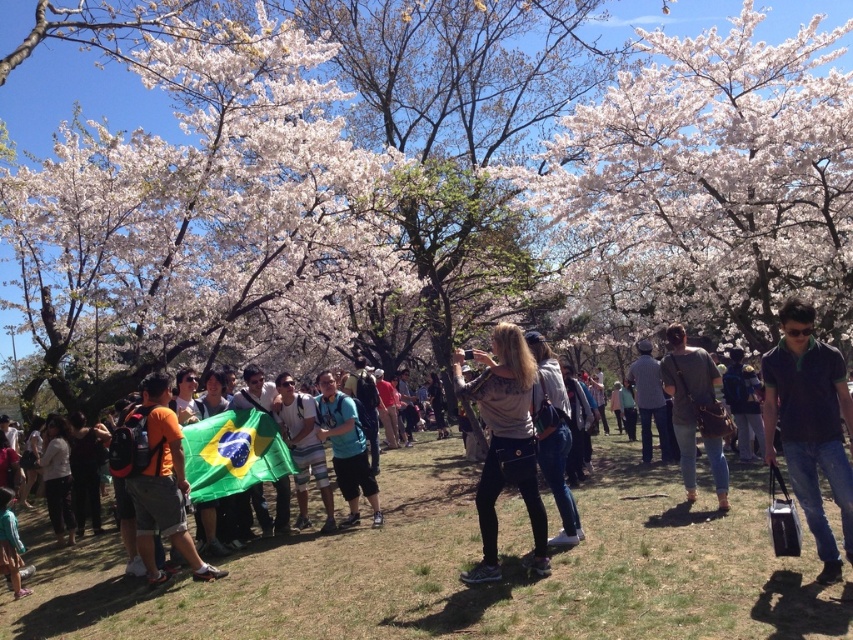
Question: Considering the real-world distances, which object is farthest from the blue fabric at center?

Choices:
 (A) brown leather bag at center
 (B) white blossoms at center
 (C) matte green flag at center

Answer: (B)

Question: Based on their relative distances, which object is nearer to the green fabric flag at center?

Choices:
 (A) blue fabric at center
 (B) dark gray shirt at center
 (C) matte beige sweater at center
 (D) white blossoms at center

Answer: (A)

Question: Which point is farther to the camera?

Choices:
 (A) dark green polo shirt at center-right
 (B) matte green flag at center
 (C) white blossoms at center

Answer: (C)

Question: Is brown leather bag at center positioned in front of denim jeans at center?

Choices:
 (A) yes
 (B) no

Answer: (B)

Question: Does white blossoms at center appear under matte beige sweater at center?

Choices:
 (A) no
 (B) yes

Answer: (A)

Question: Is matte green flag at center thinner than dark green polo shirt at center-right?

Choices:
 (A) yes
 (B) no

Answer: (B)